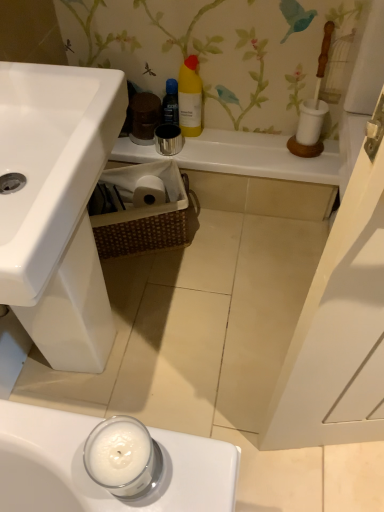
Where is `vacant space to the right of black plastic spray can at upper center`? This screenshot has height=512, width=384. vacant space to the right of black plastic spray can at upper center is located at coordinates (230, 138).